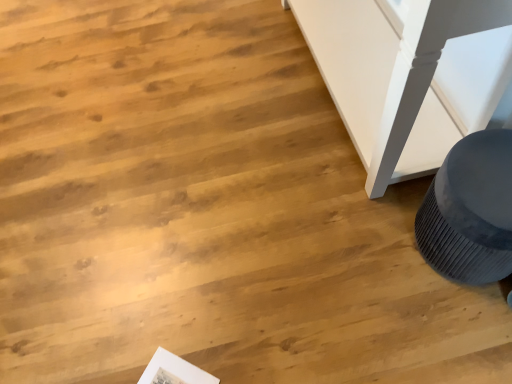
Image resolution: width=512 pixels, height=384 pixels. What are the coordinates of `white paper at lower left` in the screenshot? It's located at (174, 371).

This screenshot has width=512, height=384. Describe the element at coordinates (174, 371) in the screenshot. I see `white paper at lower left` at that location.

Locate an element on the screen. The image size is (512, 384). matte gray speaker at lower right is located at coordinates (470, 211).

Describe the element at coordinates (470, 211) in the screenshot. I see `matte gray speaker at lower right` at that location.

This screenshot has width=512, height=384. What are the coordinates of `white paper at lower left` in the screenshot? It's located at (174, 371).

Which is more to the right, matte gray speaker at lower right or white paper at lower left?

Positioned to the right is matte gray speaker at lower right.

Based on the photo, is matte gray speaker at lower right in front of white paper at lower left?

Yes, it is in front of white paper at lower left.

Does point (503, 159) come behind point (161, 365)?

No, (503, 159) is in front of (161, 365).

From the image's perspective, who appears lower, matte gray speaker at lower right or white paper at lower left?

white paper at lower left appears lower in the image.

From a real-world perspective, is matte gray speaker at lower right positioned over white paper at lower left based on gravity?

Correct, in the physical world, matte gray speaker at lower right is higher than white paper at lower left.

Can you confirm if matte gray speaker at lower right is thinner than white paper at lower left?

No, matte gray speaker at lower right is not thinner than white paper at lower left.

Considering the relative sizes of matte gray speaker at lower right and white paper at lower left in the image provided, is matte gray speaker at lower right shorter than white paper at lower left?

In fact, matte gray speaker at lower right may be taller than white paper at lower left.

Between matte gray speaker at lower right and white paper at lower left, which one has larger size?

matte gray speaker at lower right is bigger.

Choose the correct answer: Is matte gray speaker at lower right inside white paper at lower left or outside it?

matte gray speaker at lower right cannot be found inside white paper at lower left.

Is matte gray speaker at lower right beside white paper at lower left?

No.

Based on the photo, is matte gray speaker at lower right facing away from white paper at lower left?

No.

In the scene shown: How far apart are matte gray speaker at lower right and white paper at lower left?

matte gray speaker at lower right and white paper at lower left are 32.42 inches apart.

Locate an element on the screen. furniture located above the white paper at lower left (from a real-world perspective) is located at coordinates (470, 211).

Considering the relative positions of white paper at lower left and matte gray speaker at lower right in the image provided, is white paper at lower left to the right of matte gray speaker at lower right from the viewer's perspective?

In fact, white paper at lower left is to the left of matte gray speaker at lower right.

Is white paper at lower left closer to the viewer compared to matte gray speaker at lower right?

No, it is not.

Which point is more forward, (x=185, y=379) or (x=471, y=159)?

The point (x=471, y=159) is closer to the camera.

In the scene shown: From the image's perspective, which one is positioned lower, white paper at lower left or matte gray speaker at lower right?

white paper at lower left.

From a real-world perspective, who is located lower, white paper at lower left or matte gray speaker at lower right?

From a 3D spatial view, white paper at lower left is below.

Is white paper at lower left wider than matte gray speaker at lower right?

No.

In terms of height, does white paper at lower left look taller or shorter compared to matte gray speaker at lower right?

Considering their sizes, white paper at lower left has less height than matte gray speaker at lower right.

In the scene shown: Can you confirm if white paper at lower left is bigger than matte gray speaker at lower right?

No, white paper at lower left is not bigger than matte gray speaker at lower right.

Is white paper at lower left inside or outside of matte gray speaker at lower right?

white paper at lower left is located beyond the bounds of matte gray speaker at lower right.

Is there a large distance between white paper at lower left and matte gray speaker at lower right?

No, white paper at lower left is not far from matte gray speaker at lower right.

Is white paper at lower left aimed at matte gray speaker at lower right?

No, white paper at lower left does not turn towards matte gray speaker at lower right.

How many degrees apart are the facing directions of white paper at lower left and matte gray speaker at lower right?

132 degrees.

Image resolution: width=512 pixels, height=384 pixels. Identify the location of furniture above the white paper at lower left (from the image's perspective). (470, 211).

The width and height of the screenshot is (512, 384). There is a white paper at lower left. Identify the location of furniture above it (from a real-world perspective). (470, 211).

The image size is (512, 384). What are the coordinates of `magazine beneath the matte gray speaker at lower right (from a real-world perspective)` in the screenshot? It's located at [x=174, y=371].